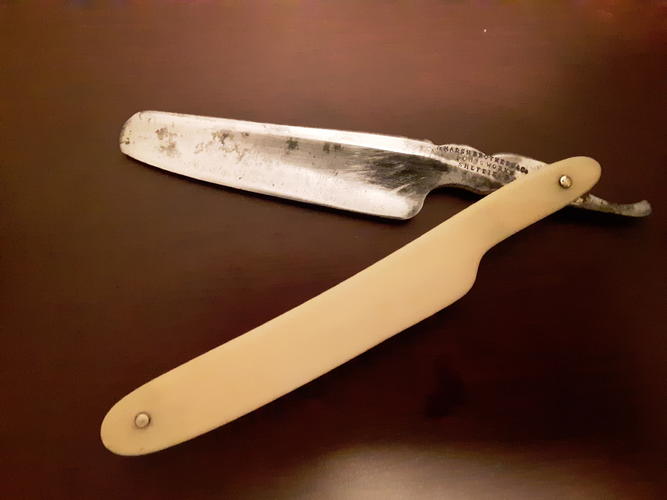
Identify the location of light on table. Image resolution: width=667 pixels, height=500 pixels. (388, 467).